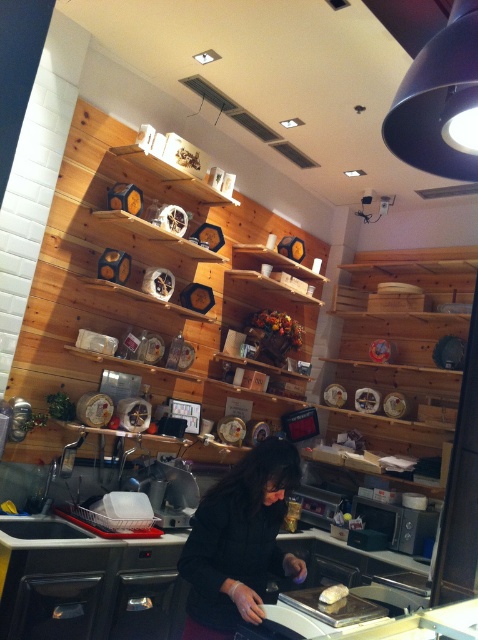
You are a delivery person who needs to place a 1.5 meter long package on the counter. The counter has a black fabric at center. Can you fit the package on the counter without moving any items?

The black fabric at center is 1.82 meters away from the camera, but the question is about the length of the counter. Since the distance from the camera doesn

You are a customer who just entered the bakery. You see the black fabric at center and the white glossy bread at center on the counter. Which object is taller?

The black fabric at center is much taller than the white glossy bread at center.

You are a customer looking at the white glossy bread at center and the satin black exhaust hood at upper right. Which object is positioned more to the right side of the scene?

The satin black exhaust hood at upper right is positioned to the right of the white glossy bread at center, so it is more to the right side of the scene.